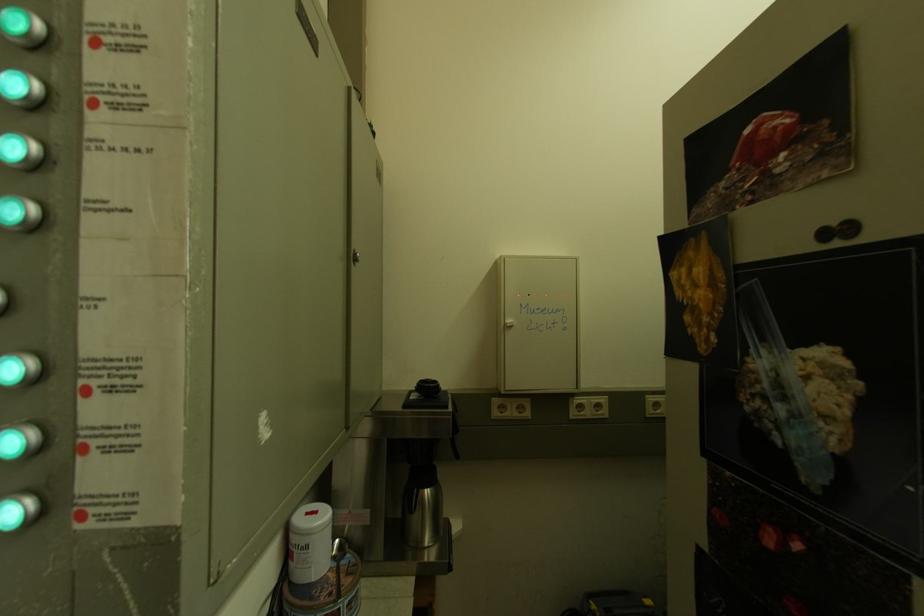
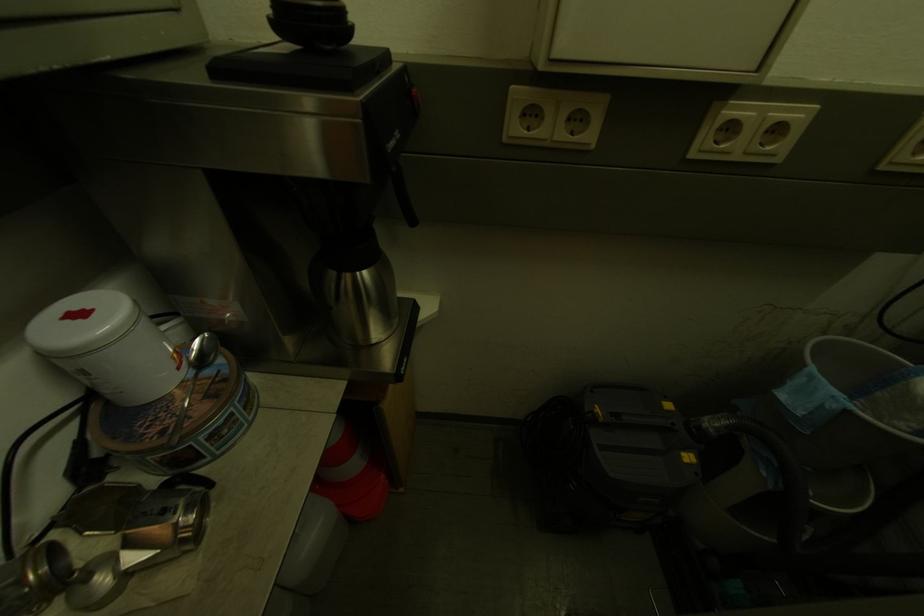
Question: How did the camera likely rotate?

Choices:
 (A) Left
 (B) Right
 (C) Up
 (D) Down

Answer: (D)